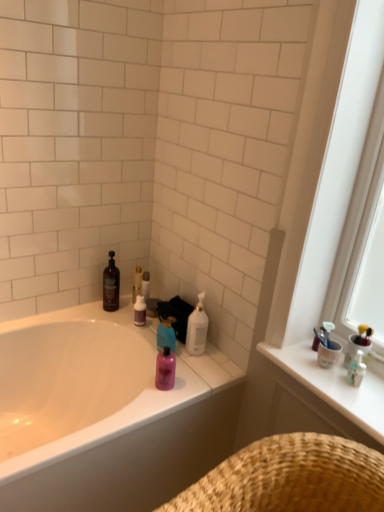
Where is `vacant region to the left of purple matte bottle at center, the third toiletry from the front`? vacant region to the left of purple matte bottle at center, the third toiletry from the front is located at coordinates (110, 317).